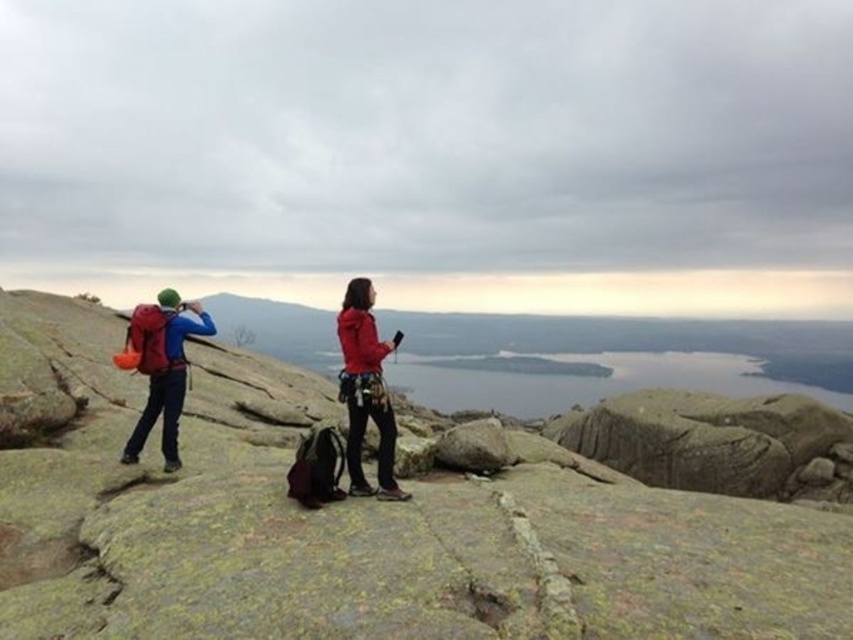
Question: Which of the following is the farthest from the observer?

Choices:
 (A) red matte jacket at center
 (B) matte red backpack at left
 (C) gray rock at center
 (D) matte blue jacket at center

Answer: (B)

Question: Is matte blue jacket at center smaller than matte red backpack at left?

Choices:
 (A) no
 (B) yes

Answer: (A)

Question: Which of the following is the closest to the observer?

Choices:
 (A) gray rock at center
 (B) matte red backpack at left

Answer: (A)

Question: Is red matte jacket at center thinner than matte red backpack at left?

Choices:
 (A) yes
 (B) no

Answer: (A)

Question: Can you confirm if matte blue jacket at center is positioned to the right of red matte jacket at center?

Choices:
 (A) no
 (B) yes

Answer: (A)

Question: Estimate the real-world distances between objects in this image. Which object is closer to the matte blue jacket at center?

Choices:
 (A) red matte jacket at center
 (B) gray rock at center

Answer: (A)